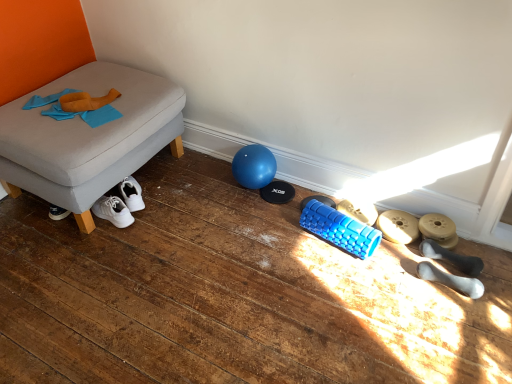
The image size is (512, 384). Identify the location of free location to the right of white rubber dumbbell at lower right, placed as the 5th footwear when sorted from back to front. (487, 294).